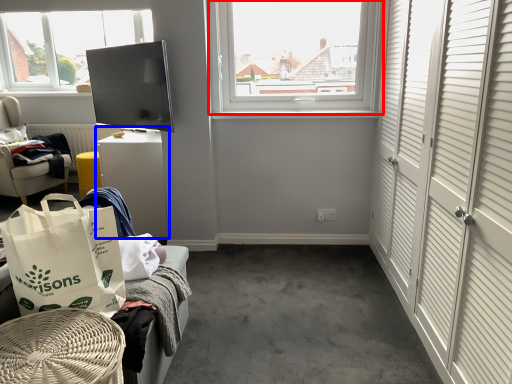
Question: Which point is further to the camera, window (highlighted by a red box) or table (highlighted by a blue box)?

Choices:
 (A) window
 (B) table

Answer: (B)